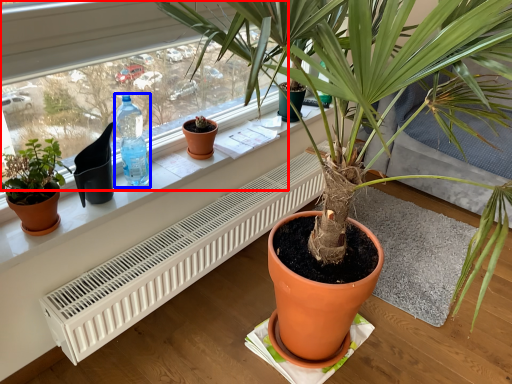
Question: Which object is further to the camera taking this photo, bay window (highlighted by a red box) or bottle (highlighted by a blue box)?

Choices:
 (A) bay window
 (B) bottle

Answer: (B)